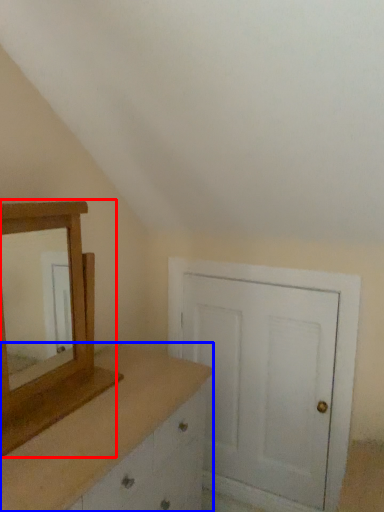
Question: Which of the following is the closest to the observer, medicine cabinet (highlighted by a red box) or chest of drawers (highlighted by a blue box)?

Choices:
 (A) medicine cabinet
 (B) chest of drawers

Answer: (B)